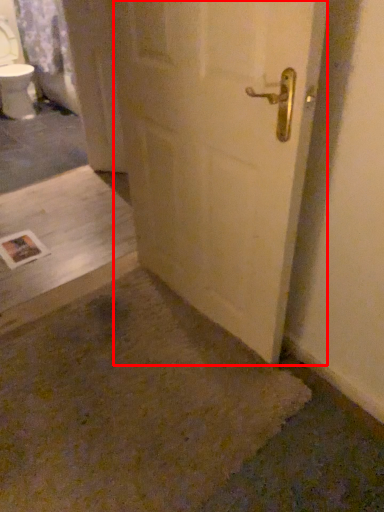
Question: From the image's perspective, where is door (annotated by the red box) located in relation to concrete in the image?

Choices:
 (A) above
 (B) below

Answer: (A)